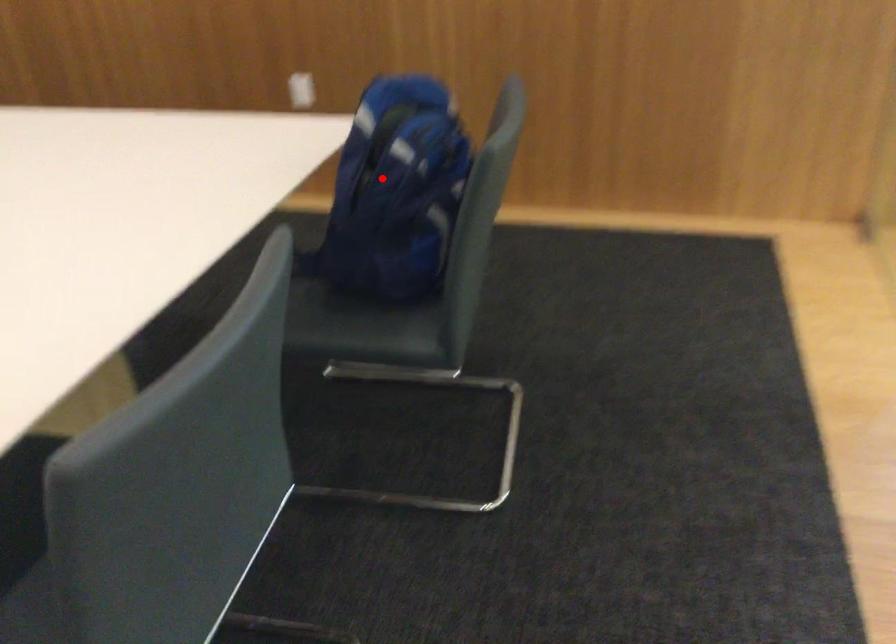
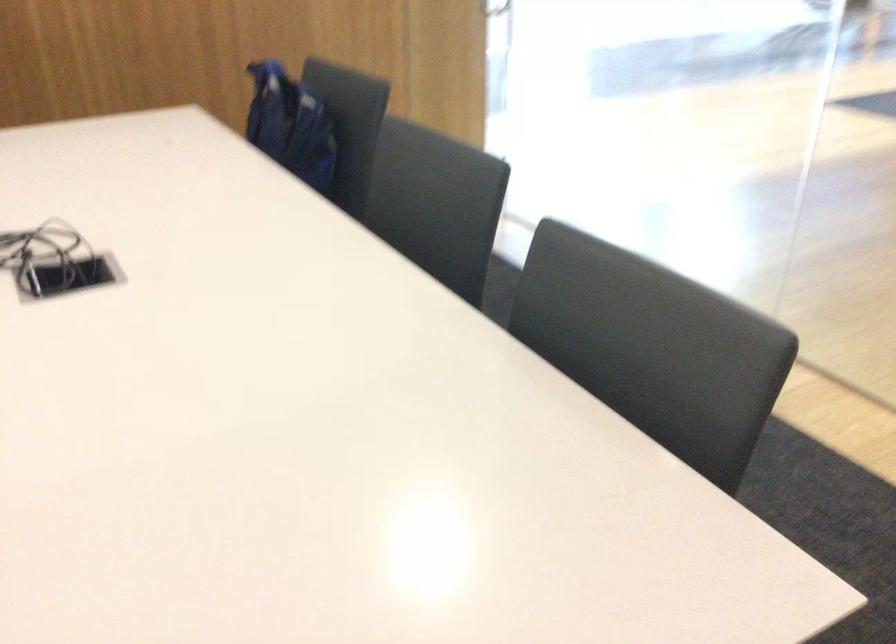
Locate, in the second image, the point that corresponds to the highlighted location in the first image.

(289, 125)